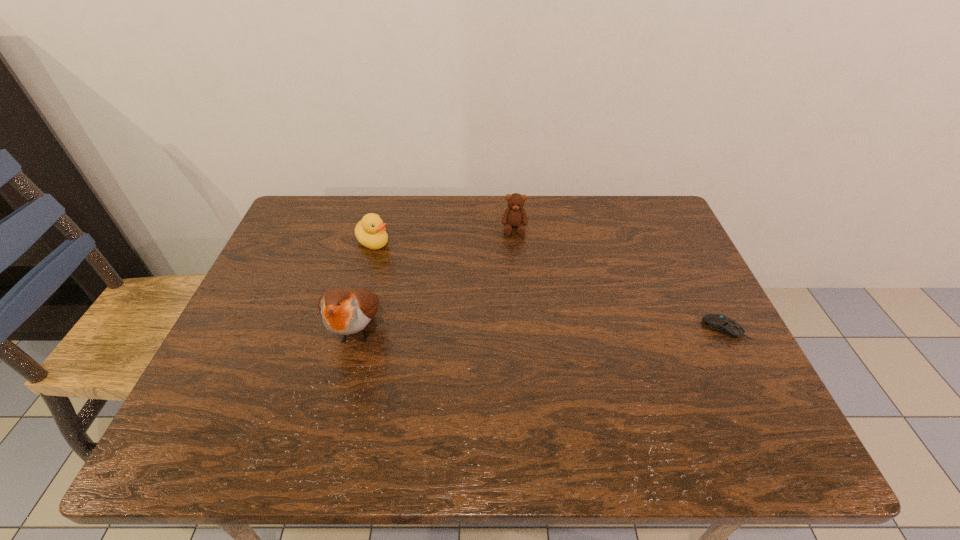
You are a GUI agent. You are given a task and a screenshot of the screen. Output one action in this format:
    pyautogui.click(x=<x>, y=<y>)
    Task: Click on the free space located 0.110m on the face of the teddy bear
    The width and height of the screenshot is (960, 540).
    Given the screenshot: What is the action you would take?
    pyautogui.click(x=515, y=262)

You are a GUI agent. You are given a task and a screenshot of the screen. Output one action in this format:
    pyautogui.click(x=<x>, y=<y>)
    Task: Click on the free space located 0.320m on the face of the teddy bear
    The image size is (960, 540).
    Given the screenshot: What is the action you would take?
    pyautogui.click(x=514, y=320)

Where is `duckling located at the far edge`? duckling located at the far edge is located at coordinates (370, 231).

Find the location of a particular element. This screenshot has height=540, width=960. teddy bear that is at the far edge is located at coordinates (515, 216).

Find the location of a particular element. The width and height of the screenshot is (960, 540). object located in the right edge section of the desktop is located at coordinates (719, 323).

Locate an element on the screen. This screenshot has width=960, height=540. vacant space at the far edge of the desktop is located at coordinates (369, 204).

This screenshot has width=960, height=540. Find the location of `free spot at the near edge of the desktop`. free spot at the near edge of the desktop is located at coordinates (572, 396).

Locate an element on the screen. The width and height of the screenshot is (960, 540). vacant region at the left edge of the desktop is located at coordinates (264, 339).

The height and width of the screenshot is (540, 960). I want to click on free location at the right edge of the desktop, so click(x=667, y=268).

The image size is (960, 540). Find the location of `blank area at the far left corner`. blank area at the far left corner is located at coordinates (317, 242).